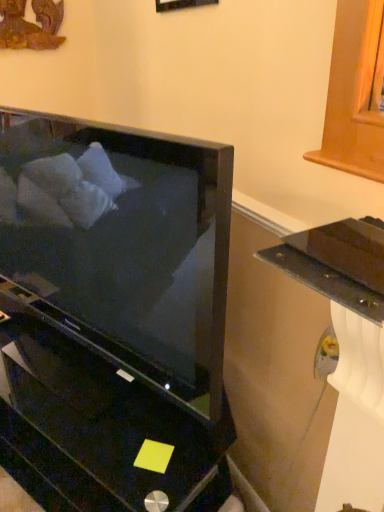
Question: From a real-world perspective, is satin black tv at center under wooden picture frame at upper center?

Choices:
 (A) yes
 (B) no

Answer: (A)

Question: Considering the relative positions of satin black tv at center and wooden picture frame at upper center in the image provided, is satin black tv at center to the left of wooden picture frame at upper center from the viewer's perspective?

Choices:
 (A) yes
 (B) no

Answer: (A)

Question: Is satin black tv at center closer to camera compared to wooden picture frame at upper center?

Choices:
 (A) no
 (B) yes

Answer: (B)

Question: From the image's perspective, is satin black tv at center beneath wooden picture frame at upper center?

Choices:
 (A) no
 (B) yes

Answer: (B)

Question: Is satin black tv at center not within wooden picture frame at upper center?

Choices:
 (A) yes
 (B) no

Answer: (A)

Question: Is satin black tv at center wider than wooden picture frame at upper center?

Choices:
 (A) no
 (B) yes

Answer: (B)

Question: Can you confirm if wooden picture frame at upper center is positioned to the left of satin black tv at center?

Choices:
 (A) yes
 (B) no

Answer: (B)

Question: Would you say wooden picture frame at upper center is outside satin black tv at center?

Choices:
 (A) yes
 (B) no

Answer: (A)

Question: From a real-world perspective, does wooden picture frame at upper center sit lower than satin black tv at center?

Choices:
 (A) no
 (B) yes

Answer: (A)

Question: Is wooden picture frame at upper center facing away from satin black tv at center?

Choices:
 (A) yes
 (B) no

Answer: (B)

Question: Is wooden picture frame at upper center at the right side of satin black tv at center?

Choices:
 (A) yes
 (B) no

Answer: (A)

Question: Is wooden picture frame at upper center behind satin black tv at center?

Choices:
 (A) no
 (B) yes

Answer: (B)

Question: Would you say wooden picture frame at upper center is to the left or to the right of satin black tv at center in the picture?

Choices:
 (A) right
 (B) left

Answer: (A)